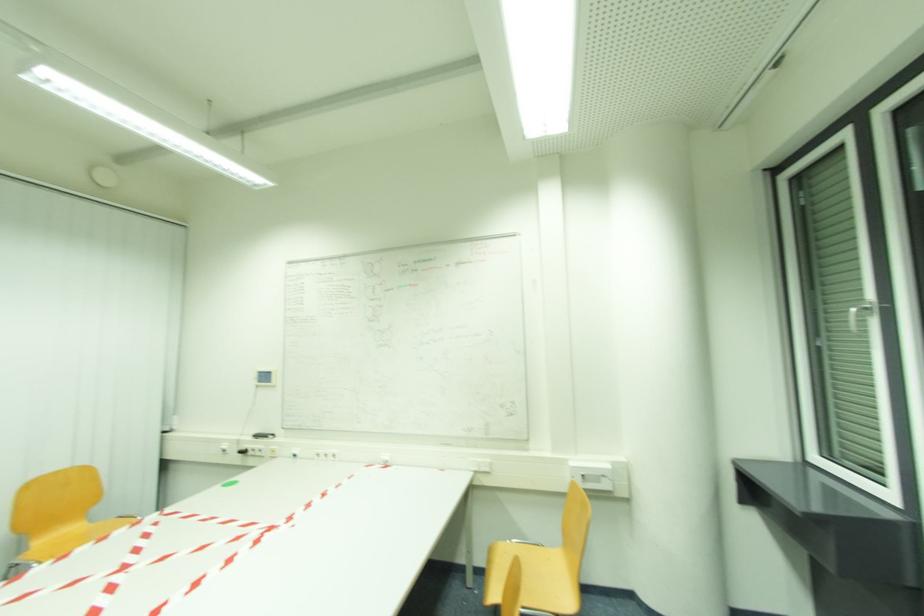
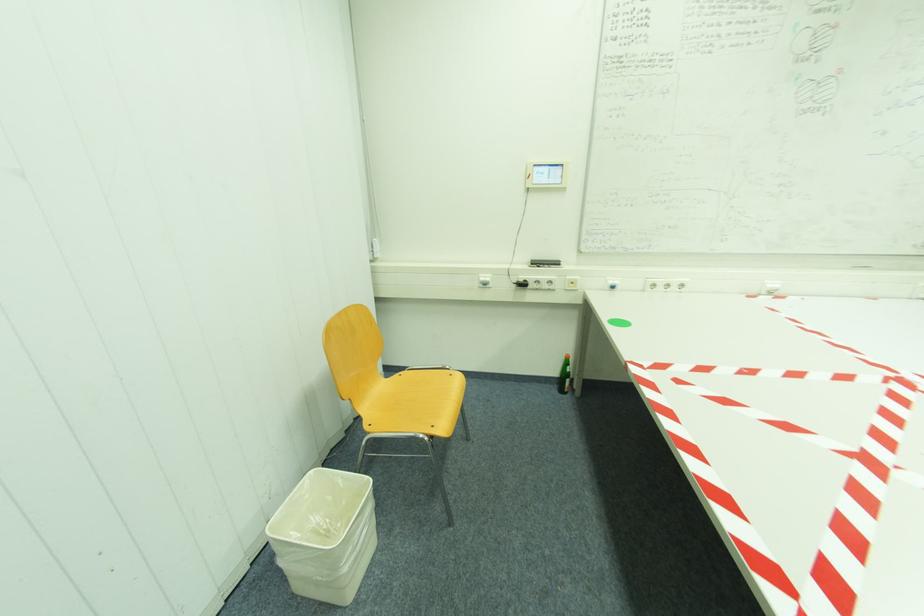
What movement of the cameraman would produce the second image?

The movement direction of the cameraman is left, forward.